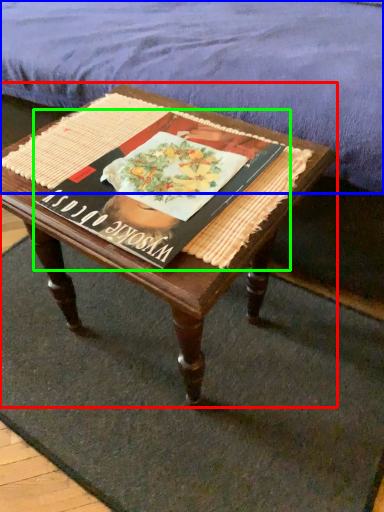
Question: Which is nearer to the coffee table (highlighted by a red box)? mattress (highlighted by a blue box) or paperback book (highlighted by a green box).

Choices:
 (A) mattress
 (B) paperback book

Answer: (B)